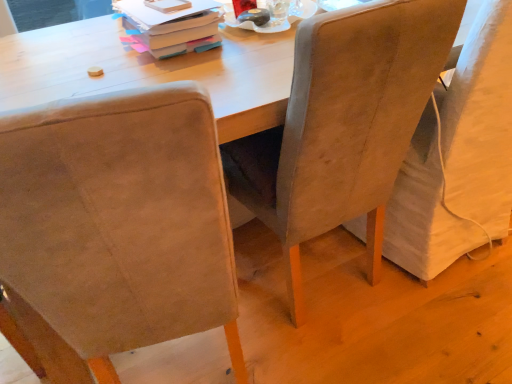
In order to click on free space above matte cardboard book at upper center (from a real-world perspective) in this screenshot , I will do `click(167, 6)`.